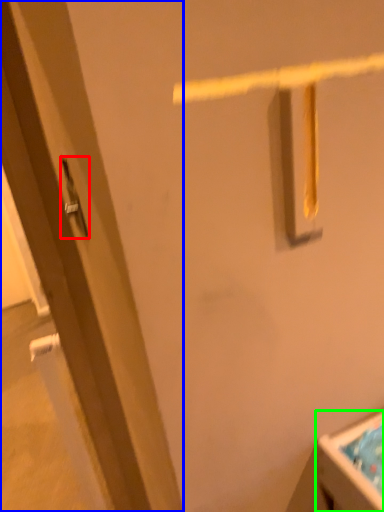
Question: Estimate the real-world distances between objects in this image. Which object is farther from door handle (highlighted by a red box), door (highlighted by a blue box) or sink (highlighted by a green box)?

Choices:
 (A) door
 (B) sink

Answer: (B)